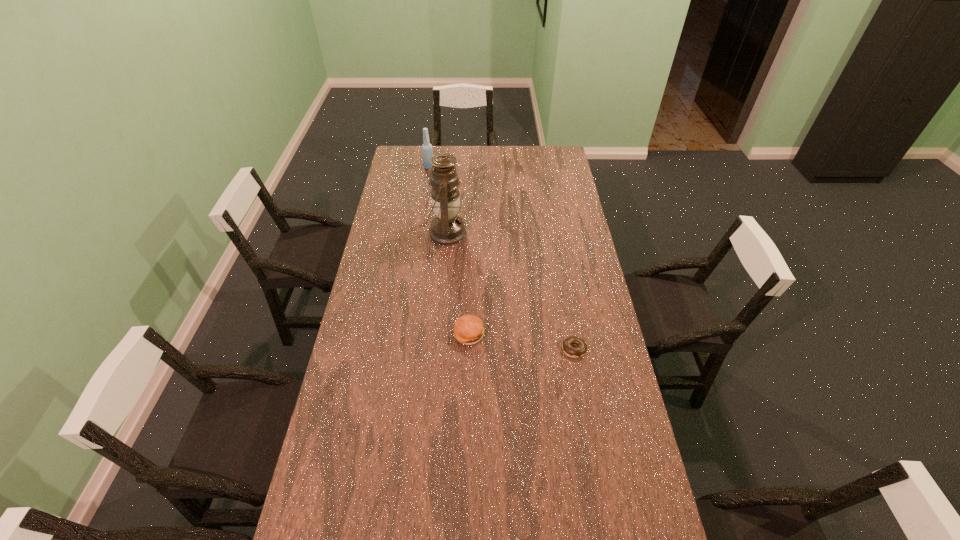
Find the location of `unoccupied position between the third shortest object and the tallest object`. unoccupied position between the third shortest object and the tallest object is located at coordinates (457, 284).

Identify the location of free spot between the hamburger and the farthest object. (449, 251).

At what (x,y) coordinates should I click in order to perform the action: click on vacant space that's between the third shortest object and the farthest object. Please return your answer as a coordinate pair (x, y). Image resolution: width=960 pixels, height=540 pixels. Looking at the image, I should click on (449, 251).

What are the coordinates of `free point between the hamburger and the rightmost object` in the screenshot? It's located at (521, 342).

The height and width of the screenshot is (540, 960). I want to click on empty space between the oil lamp and the rightmost object, so click(x=510, y=291).

Identify the location of vacant space that's between the third shortest object and the oil lamp. This screenshot has width=960, height=540. point(457,284).

Where is `the fourth closest object to the shortest object`? This screenshot has width=960, height=540. the fourth closest object to the shortest object is located at coordinates (427, 152).

Locate which object is the second closest to the watch. Please provide its 2D coordinates. Your answer should be formatted as a tuple, i.e. [(x, y)], where the tuple contains the x and y coordinates of a point satisfying the conditions above.

[(468, 329)]

Locate an element on the screen. vacant space that satisfies the following two spatial constraints: 1. on the front side of the bottle; 2. on the right side of the hamburger is located at coordinates click(404, 334).

Where is `blank area in the image that satisfies the following two spatial constraints: 1. on the front side of the tallest object; 2. on the right side of the third tallest object`? This screenshot has height=540, width=960. blank area in the image that satisfies the following two spatial constraints: 1. on the front side of the tallest object; 2. on the right side of the third tallest object is located at coordinates (438, 334).